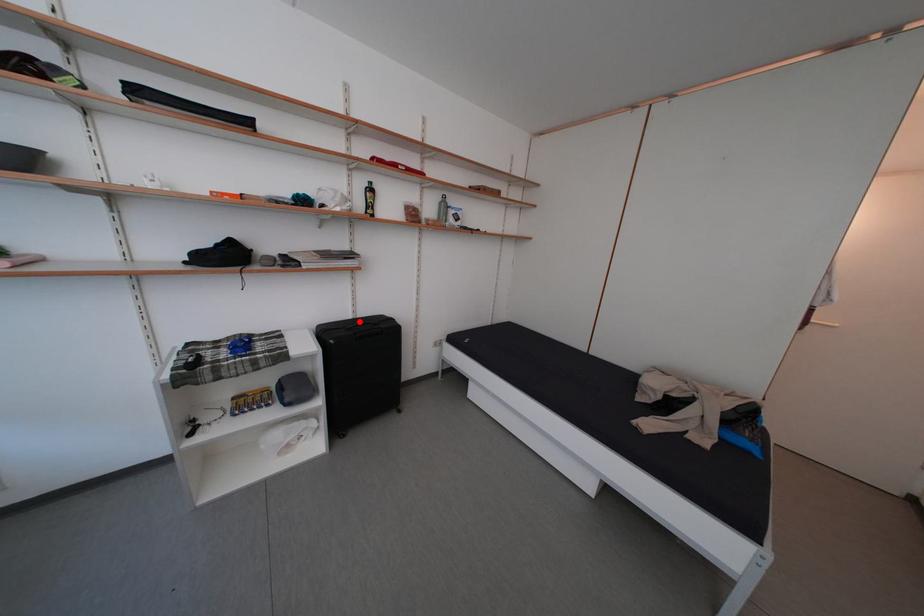
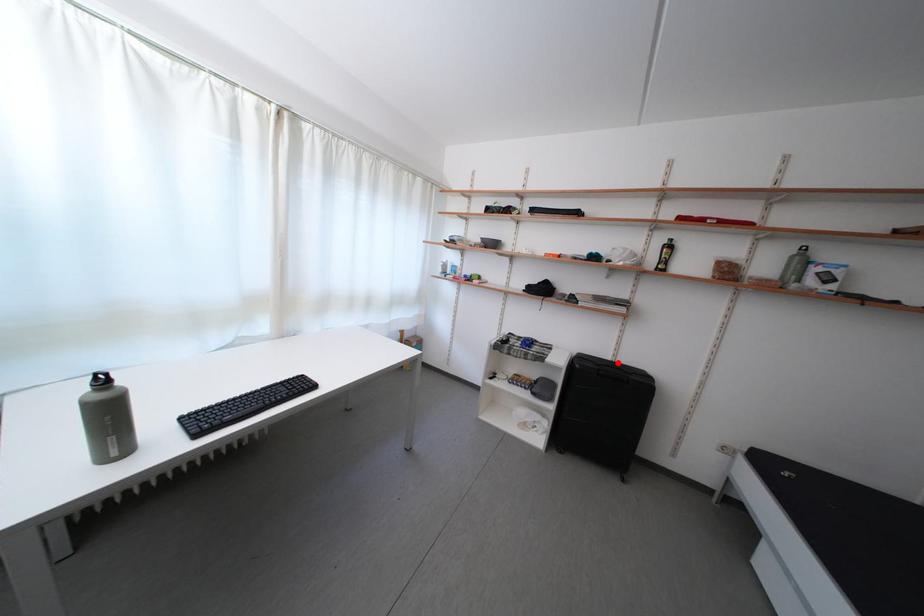
I am providing you with two images of the same scene from different viewpoints. A red point is marked on the first image and another point is marked on the second image. Are the points marked in image1 and image2 representing the same 3D position?

Yes